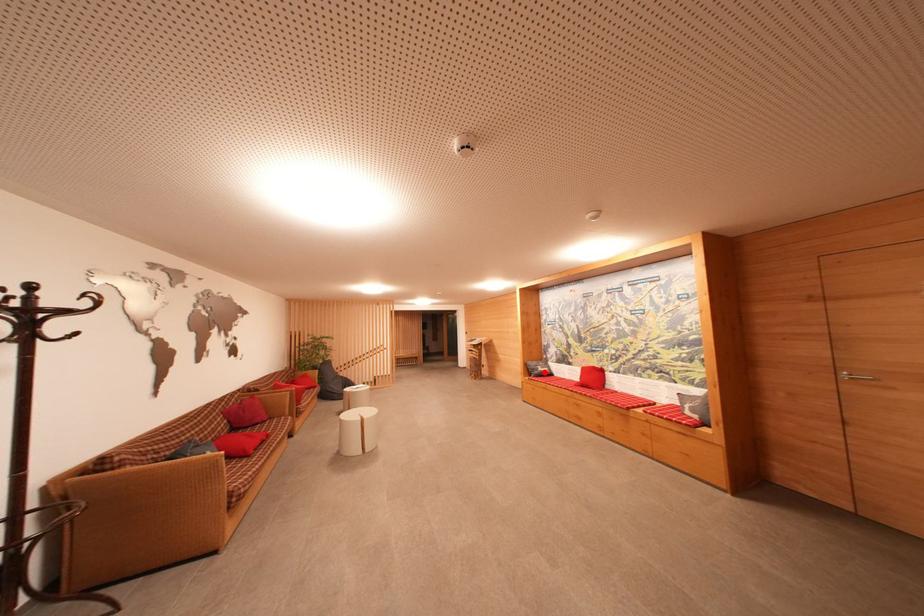
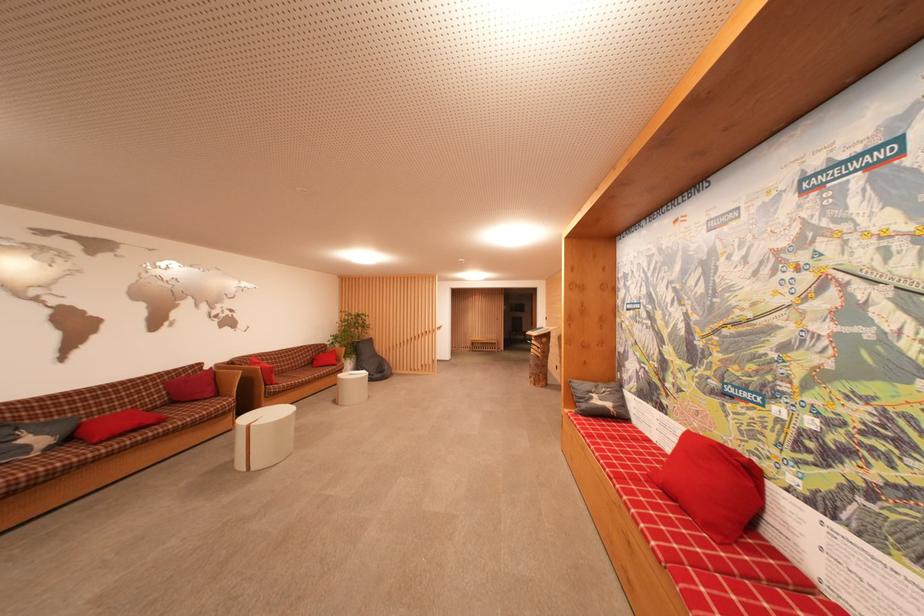
Locate, in the second image, the point that corresponds to the highlighted location in the first image.

(601, 405)